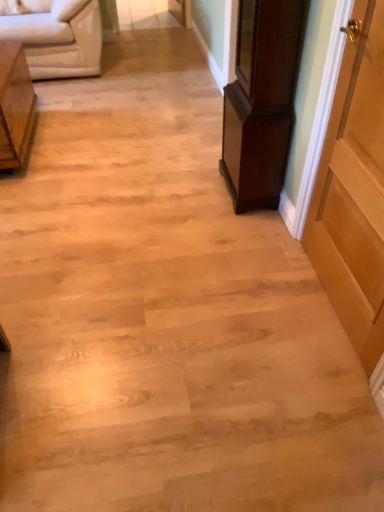
Where is `free space behind light brown wood door at right`? This screenshot has height=512, width=384. free space behind light brown wood door at right is located at coordinates (262, 243).